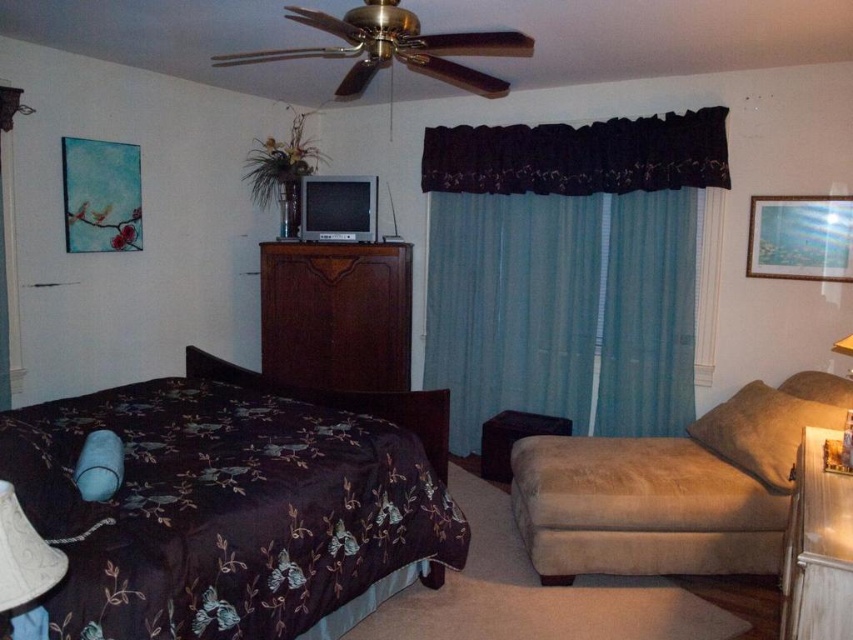
You are standing in the bedroom and want to place a new desk between the dark floral fabric bed at center and the white fabric lampshade at lower left. Based on their positions, which side of the desk should face the wall?

The dark floral fabric bed at center is to the left of the white fabric lampshade at lower left. Therefore, the desk should be positioned so that its right side faces the wall to align with the existing arrangement.

You are moving a small decorative item from the dark wood dresser at center to the dark floral fabric bed at center. Which surface will require more space to place the item?

The dark floral fabric bed at center has a larger size compared to the dark wood dresser at center, so placing the item on the bed will require more space.

You are taking a photo of the bedroom scene. You notice two points in the image at coordinates point [32,461] and point [22,550]. Which point is closer to the camera?

Point [32,461] is further to the camera than point [22,550], so the closer point to the camera is point [22,550].